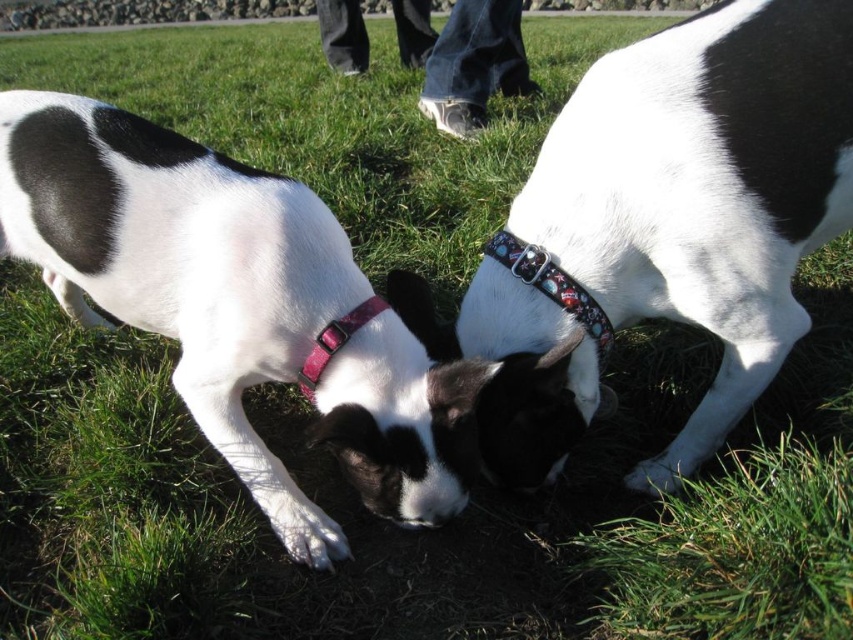
Question: Which object appears farthest from the camera in this image?

Choices:
 (A) pink fabric collar at center
 (B) white matte dog at center

Answer: (A)

Question: Estimate the real-world distances between objects in this image. Which object is farther from the white matte dog at center?

Choices:
 (A) white fabric collar at center
 (B) pink fabric collar at center
 (C) multicolored fabric collar at center

Answer: (C)

Question: Can you confirm if white matte dog at center is wider than pink fabric collar at center?

Choices:
 (A) yes
 (B) no

Answer: (A)

Question: Is multicolored fabric collar at center smaller than pink fabric collar at center?

Choices:
 (A) yes
 (B) no

Answer: (B)

Question: Does multicolored fabric collar at center appear under pink fabric collar at center?

Choices:
 (A) no
 (B) yes

Answer: (A)

Question: Which object is farther from the camera taking this photo?

Choices:
 (A) pink fabric collar at center
 (B) multicolored fabric collar at center
 (C) white fabric collar at center

Answer: (B)